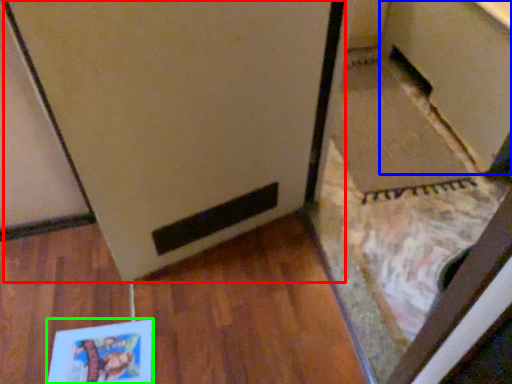
Question: Based on their relative distances, which object is farther from fridge (highlighted by a red box)? Choose from cabinetry (highlighted by a blue box) and book (highlighted by a green box).

Choices:
 (A) cabinetry
 (B) book

Answer: (A)